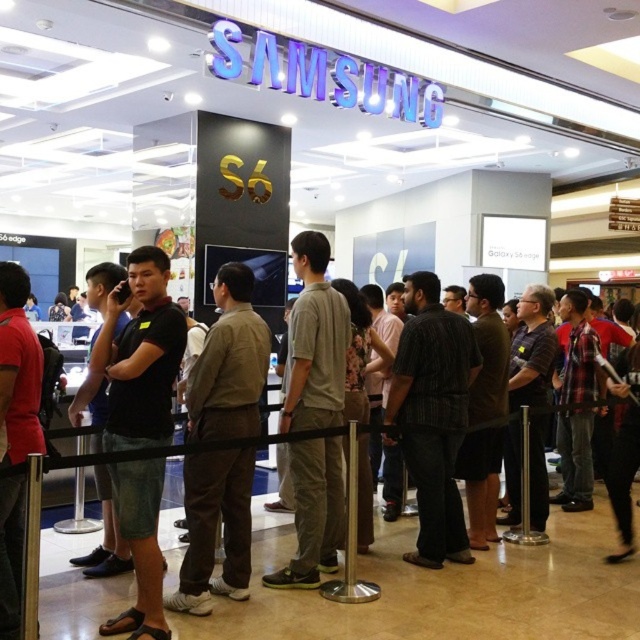
Question: Which object is closer to the camera taking this photo?

Choices:
 (A) striped shirt at center
 (B) gray cotton shirt at center
 (C) black cotton shirt at center

Answer: (C)

Question: Estimate the real-world distances between objects in this image. Which object is closer to the matte black shirt at left?

Choices:
 (A) black cotton shirt at center
 (B) brown cotton shirt at center
 (C) striped shirt at center

Answer: (A)

Question: Does brown cotton shirt at center have a greater width compared to black cotton shirt at center?

Choices:
 (A) yes
 (B) no

Answer: (B)

Question: Can you confirm if black cotton shirt at center is positioned below matte black shirt at left?

Choices:
 (A) no
 (B) yes

Answer: (B)

Question: Which object appears closest to the camera in this image?

Choices:
 (A) brown cotton shirt at center
 (B) matte black shirt at left
 (C) striped shirt at center
 (D) black cotton shirt at center

Answer: (B)

Question: Does black cotton shirt at center appear on the left side of matte black shirt at left?

Choices:
 (A) no
 (B) yes

Answer: (A)